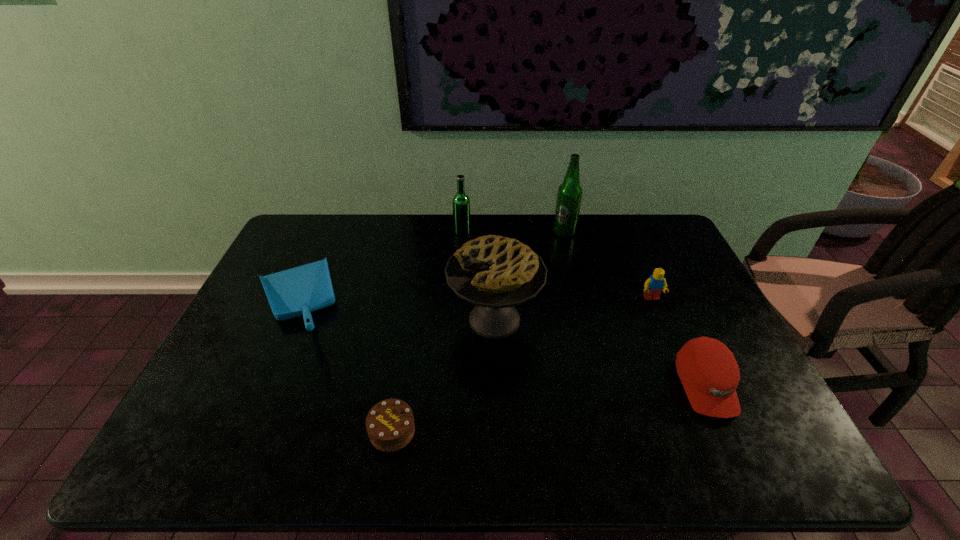
Where is `vacant space located 0.400m on the cut side of the pie`? Image resolution: width=960 pixels, height=540 pixels. vacant space located 0.400m on the cut side of the pie is located at coordinates (307, 320).

You are a GUI agent. You are given a task and a screenshot of the screen. Output one action in this format:
    pyautogui.click(x=<x>, y=<y>)
    Task: Click on the free space located on the cut side of the pie
    
    Given the screenshot: What is the action you would take?
    pyautogui.click(x=413, y=320)

This screenshot has height=540, width=960. Find the location of `free region located on the cut side of the pie`. free region located on the cut side of the pie is located at coordinates (335, 320).

Find the location of a particular element. This screenshot has width=960, height=540. vacant point located 0.260m on the left of the left beer bottle is located at coordinates (381, 233).

Identify the location of free space located 0.070m on the back of the dustpan. (320, 247).

Where is `vacant area situated on the front-facing side of the Lego`? Image resolution: width=960 pixels, height=540 pixels. vacant area situated on the front-facing side of the Lego is located at coordinates (661, 323).

Find the location of a particular element. Image resolution: width=960 pixels, height=540 pixels. free region located on the front-facing side of the cap is located at coordinates (734, 448).

Find the location of a particular element. This screenshot has width=960, height=540. free spot located on the right of the chocolate cake is located at coordinates (579, 431).

Where is `object located at the near edge`? Image resolution: width=960 pixels, height=540 pixels. object located at the near edge is located at coordinates (390, 426).

The width and height of the screenshot is (960, 540). Identify the location of object that is positioned at the left edge. (298, 291).